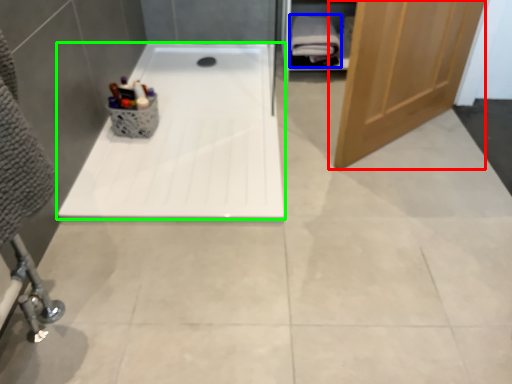
Question: Which object is the closest to the door (highlighted by a red box)? Choose among these: bath towel (highlighted by a blue box) or bathtub (highlighted by a green box).

Choices:
 (A) bath towel
 (B) bathtub

Answer: (B)